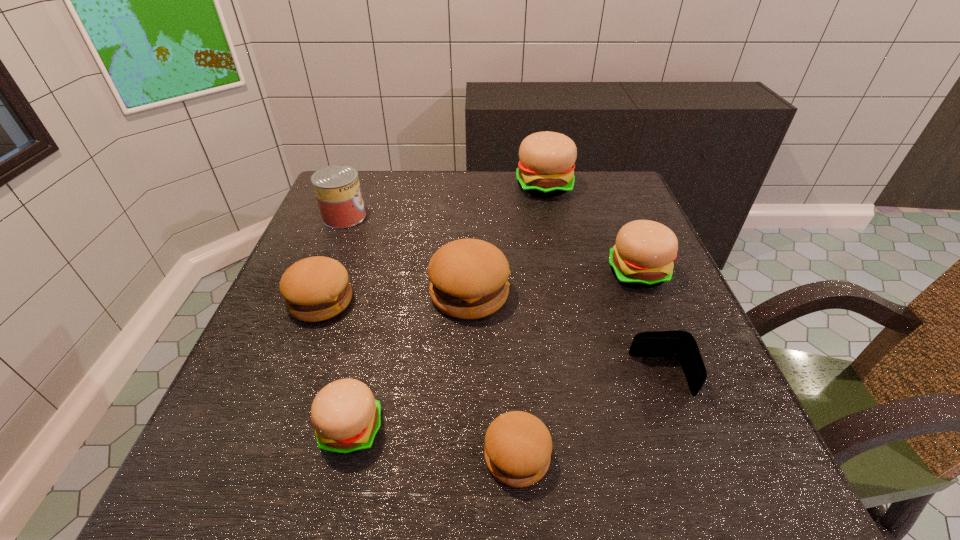
What are the coordinates of `wallet` in the screenshot? It's located at (681, 344).

I want to click on the shortest hamburger, so click(x=518, y=446).

Image resolution: width=960 pixels, height=540 pixels. In order to click on the smallest brown hamburger in this screenshot , I will do `click(518, 446)`.

Find the location of a particular element. The width and height of the screenshot is (960, 540). free point located 0.120m on the front of the tallest object is located at coordinates (553, 228).

The height and width of the screenshot is (540, 960). I want to click on vacant space situated 0.300m on the right of the seventh nearest object, so click(x=484, y=217).

Identify the location of free space located on the left of the rightmost beige hamburger. (585, 273).

I want to click on blank space located on the back of the biggest brown hamburger, so (471, 231).

Where is `free region located 0.120m on the back of the second smallest brown hamburger`? The height and width of the screenshot is (540, 960). free region located 0.120m on the back of the second smallest brown hamburger is located at coordinates (342, 245).

Locate an element on the screen. This screenshot has width=960, height=540. vacant space located 0.270m on the right of the sixth object from right to left is located at coordinates (556, 429).

This screenshot has height=540, width=960. Identify the location of vacant space located 0.180m on the outer surface of the wallet. (529, 376).